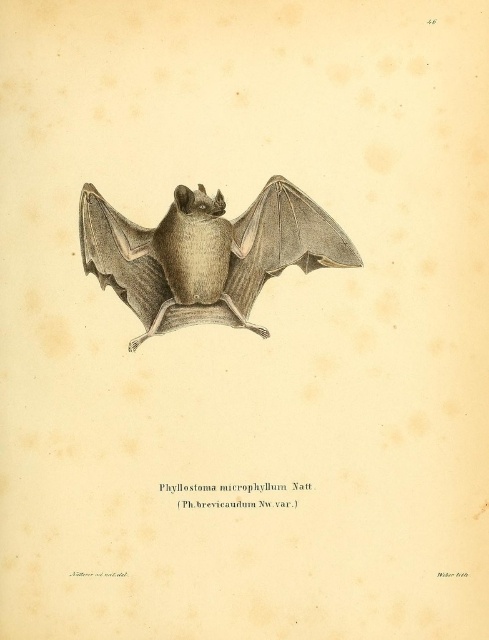
Between gray textured bat at center and matte gray wing at center, which one has less height?

Standing shorter between the two is matte gray wing at center.

Between gray textured bat at center and matte gray wing at center, which one is positioned higher?

matte gray wing at center is above.

Is point (80, 224) positioned after point (155, 316)?

No, it is in front of (155, 316).

Identify the location of gray textured bat at center. The height and width of the screenshot is (640, 489). (206, 253).

Does gray textured bat at center appear under gray textured wing at center?

Incorrect, gray textured bat at center is not positioned below gray textured wing at center.

Describe the element at coordinates (206, 253) in the screenshot. I see `gray textured bat at center` at that location.

What are the coordinates of `gray textured bat at center` in the screenshot? It's located at (x=206, y=253).

Is gray textured wing at center positioned before matte gray wing at center?

No.

Is point (246, 280) positioned after point (154, 266)?

Yes, it is behind point (154, 266).

What are the coordinates of `gray textured wing at center` in the screenshot? It's located at (282, 241).